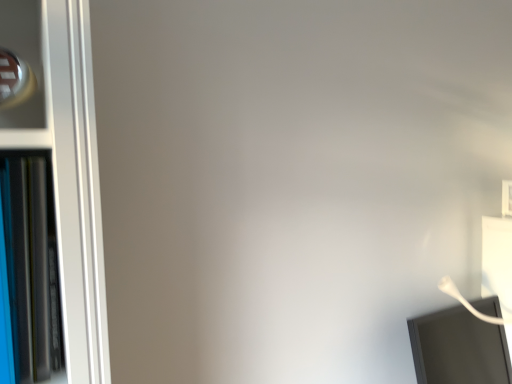
What do you see at coordinates (458, 349) in the screenshot?
I see `white glossy computer monitor at lower right` at bounding box center [458, 349].

Measure the distance between white glossy computer monitor at lower right and camera.

white glossy computer monitor at lower right is 1.20 meters from camera.

Locate an element on the screen. The width and height of the screenshot is (512, 384). white glossy computer monitor at lower right is located at coordinates (458, 349).

I want to click on blue glossy bookshelf at left, so click(32, 267).

What do you see at coordinates (32, 267) in the screenshot?
I see `blue glossy bookshelf at left` at bounding box center [32, 267].

Measure the distance between point (6, 181) and camera.

22.20 inches.

Where is `white glossy computer monitor at lower right`? The image size is (512, 384). white glossy computer monitor at lower right is located at coordinates [458, 349].

Considering the positions of objects white glossy computer monitor at lower right and blue glossy bookshelf at left in the image provided, who is more to the right, white glossy computer monitor at lower right or blue glossy bookshelf at left?

From the viewer's perspective, white glossy computer monitor at lower right appears more on the right side.

Which is in front, white glossy computer monitor at lower right or blue glossy bookshelf at left?

blue glossy bookshelf at left.

Is point (425, 331) farther from camera compared to point (52, 336)?

Yes.

From the image's perspective, is white glossy computer monitor at lower right above blue glossy bookshelf at left?

Incorrect, from the image's perspective, white glossy computer monitor at lower right is lower than blue glossy bookshelf at left.

From a real-world perspective, between white glossy computer monitor at lower right and blue glossy bookshelf at left, who is vertically higher?

blue glossy bookshelf at left is physically above.

Considering the sizes of white glossy computer monitor at lower right and blue glossy bookshelf at left in the image, is white glossy computer monitor at lower right wider or thinner than blue glossy bookshelf at left?

Clearly, white glossy computer monitor at lower right has more width compared to blue glossy bookshelf at left.

Who is taller, white glossy computer monitor at lower right or blue glossy bookshelf at left?

Standing taller between the two is blue glossy bookshelf at left.

Can you confirm if white glossy computer monitor at lower right is smaller than blue glossy bookshelf at left?

Actually, white glossy computer monitor at lower right might be larger than blue glossy bookshelf at left.

Would you say white glossy computer monitor at lower right is inside or outside blue glossy bookshelf at left?

white glossy computer monitor at lower right is outside blue glossy bookshelf at left.

Would you say white glossy computer monitor at lower right is a long distance from blue glossy bookshelf at left?

Yes, white glossy computer monitor at lower right and blue glossy bookshelf at left are located far from each other.

Is white glossy computer monitor at lower right aimed at blue glossy bookshelf at left?

No, white glossy computer monitor at lower right is not facing towards blue glossy bookshelf at left.

How many degrees apart are the facing directions of white glossy computer monitor at lower right and blue glossy bookshelf at left?

The angle between the facing direction of white glossy computer monitor at lower right and the facing direction of blue glossy bookshelf at left is 4.81 degrees.

Measure the distance from white glossy computer monitor at lower right to blue glossy bookshelf at left.

white glossy computer monitor at lower right and blue glossy bookshelf at left are 3.59 feet apart from each other.

Identify the location of computer monitor below the blue glossy bookshelf at left (from the image's perspective). The width and height of the screenshot is (512, 384). (458, 349).

Which is more to the right, blue glossy bookshelf at left or white glossy computer monitor at lower right?

Positioned to the right is white glossy computer monitor at lower right.

Relative to white glossy computer monitor at lower right, is blue glossy bookshelf at left in front or behind?

blue glossy bookshelf at left is positioned closer to the viewer than white glossy computer monitor at lower right.

Is point (11, 204) closer or farther from the camera than point (493, 334)?

Point (11, 204) is positioned closer to the camera compared to point (493, 334).

From the image's perspective, is blue glossy bookshelf at left beneath white glossy computer monitor at lower right?

No, from the image's perspective, blue glossy bookshelf at left is not below white glossy computer monitor at lower right.

From a real-world perspective, is blue glossy bookshelf at left positioned over white glossy computer monitor at lower right based on gravity?

Yes, from a real-world perspective, blue glossy bookshelf at left is over white glossy computer monitor at lower right

Looking at this image, considering the relative sizes of blue glossy bookshelf at left and white glossy computer monitor at lower right in the image provided, is blue glossy bookshelf at left thinner than white glossy computer monitor at lower right?

Yes, blue glossy bookshelf at left is thinner than white glossy computer monitor at lower right.

Can you confirm if blue glossy bookshelf at left is taller than white glossy computer monitor at lower right?

Indeed, blue glossy bookshelf at left has a greater height compared to white glossy computer monitor at lower right.

Is blue glossy bookshelf at left bigger than white glossy computer monitor at lower right?

Incorrect, blue glossy bookshelf at left is not larger than white glossy computer monitor at lower right.

Is white glossy computer monitor at lower right completely or partially inside blue glossy bookshelf at left?

No, blue glossy bookshelf at left does not contain white glossy computer monitor at lower right.

Is blue glossy bookshelf at left positioned far away from white glossy computer monitor at lower right?

That's right, there is a large distance between blue glossy bookshelf at left and white glossy computer monitor at lower right.

Could you tell me if blue glossy bookshelf at left is turned towards white glossy computer monitor at lower right?

No, blue glossy bookshelf at left is not aimed at white glossy computer monitor at lower right.

Can you tell me how much blue glossy bookshelf at left and white glossy computer monitor at lower right differ in facing direction?

4.81 degrees separate the facing orientations of blue glossy bookshelf at left and white glossy computer monitor at lower right.

Where is `computer monitor below the blue glossy bookshelf at left (from the image's perspective)`? Image resolution: width=512 pixels, height=384 pixels. computer monitor below the blue glossy bookshelf at left (from the image's perspective) is located at coordinates (458, 349).

Where is `bookcase on the left of white glossy computer monitor at lower right`? bookcase on the left of white glossy computer monitor at lower right is located at coordinates (32, 267).

Find the location of a particular element. computer monitor on the right of blue glossy bookshelf at left is located at coordinates (458, 349).